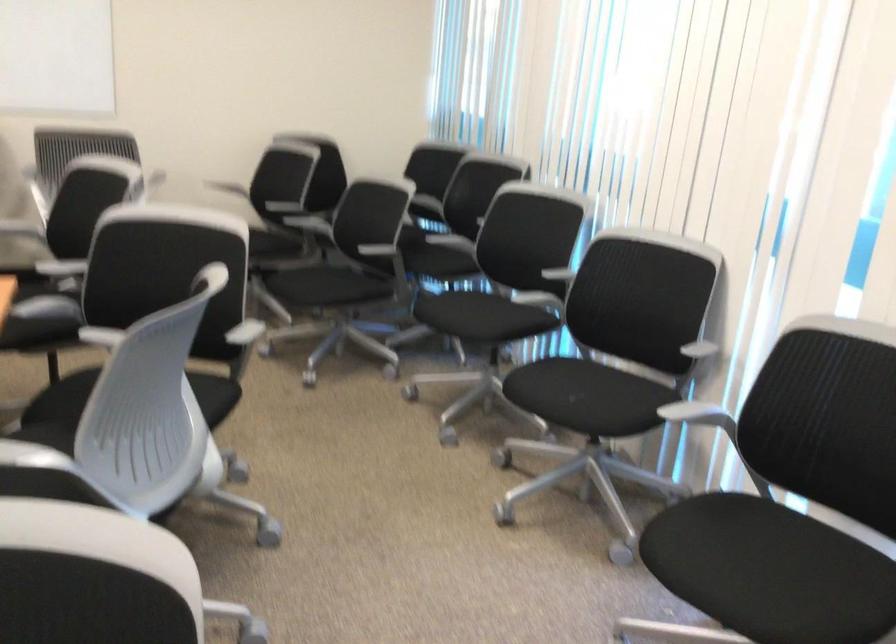
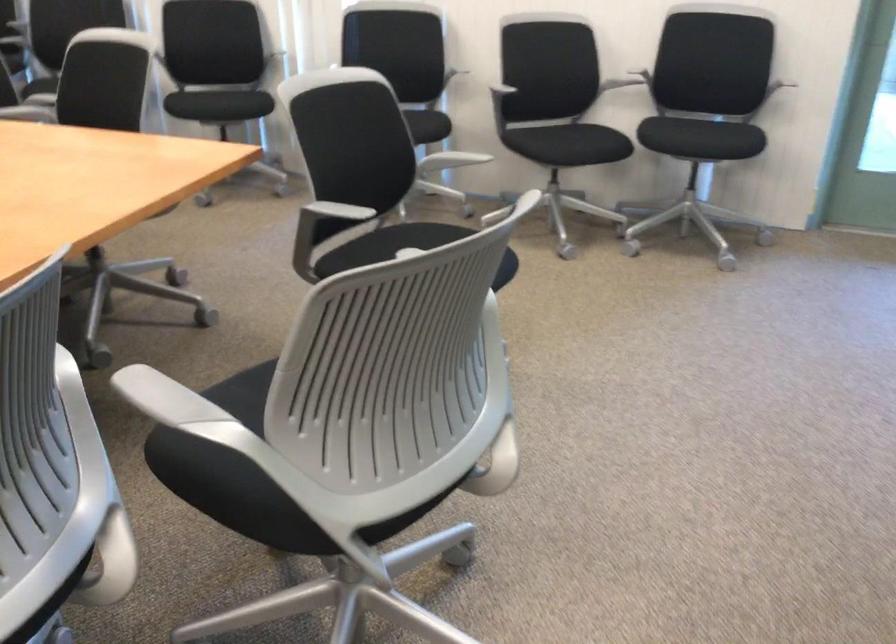
The point at (592, 418) is marked in the first image. Where is the corresponding point in the second image?

(238, 102)